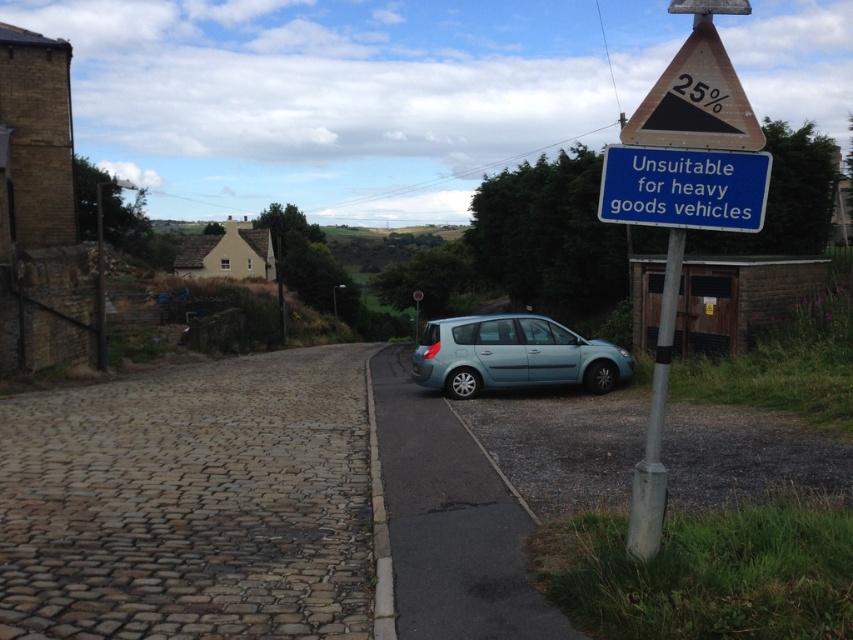
Which is more to the right, wooden triangular sign at upper right or silver metallic pole at right?

wooden triangular sign at upper right

Is point (677, 80) positioned after point (643, 532)?

No, it is not.

I want to click on wooden triangular sign at upper right, so click(x=695, y=100).

Is point (699, 211) closer to viewer compared to point (637, 115)?

That is True.

Does point (654, 161) come behind point (686, 138)?

Yes, it is.

Where is `blue metallic sign at upper right`? blue metallic sign at upper right is located at coordinates (683, 188).

Which of these two, light blue metallic car at center or silver metallic pole at right, stands shorter?

light blue metallic car at center

Which is behind, point (595, 346) or point (659, 348)?

Point (595, 346)

Between point (471, 320) and point (670, 339), which one is positioned behind?

Point (471, 320)

Find the location of a particular element. This screenshot has width=853, height=640. light blue metallic car at center is located at coordinates (514, 355).